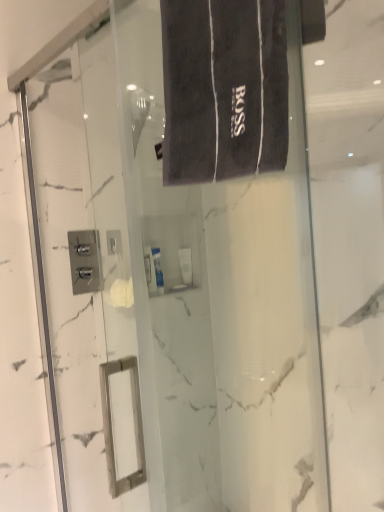
Question: Is dark gray terry cloth bath towel at upper center wider or thinner than white glossy tube at center, the first toiletry from the front?

Choices:
 (A) wide
 (B) thin

Answer: (A)

Question: Would you say dark gray terry cloth bath towel at upper center is to the left or to the right of white glossy tube at center, the first toiletry from the front, in the picture?

Choices:
 (A) left
 (B) right

Answer: (B)

Question: Considering the real-world distances, which object is closest to the white glossy tube at center, the first toiletry from the front?

Choices:
 (A) white glossy tube at center, marked as the second toiletry in a front-to-back arrangement
 (B) dark gray terry cloth bath towel at upper center

Answer: (A)

Question: Which object is the farthest from the dark gray terry cloth bath towel at upper center?

Choices:
 (A) white glossy tube at center, marked as the second toiletry in a front-to-back arrangement
 (B) white glossy tube at center, which ranks as the second toiletry in back-to-front order

Answer: (A)